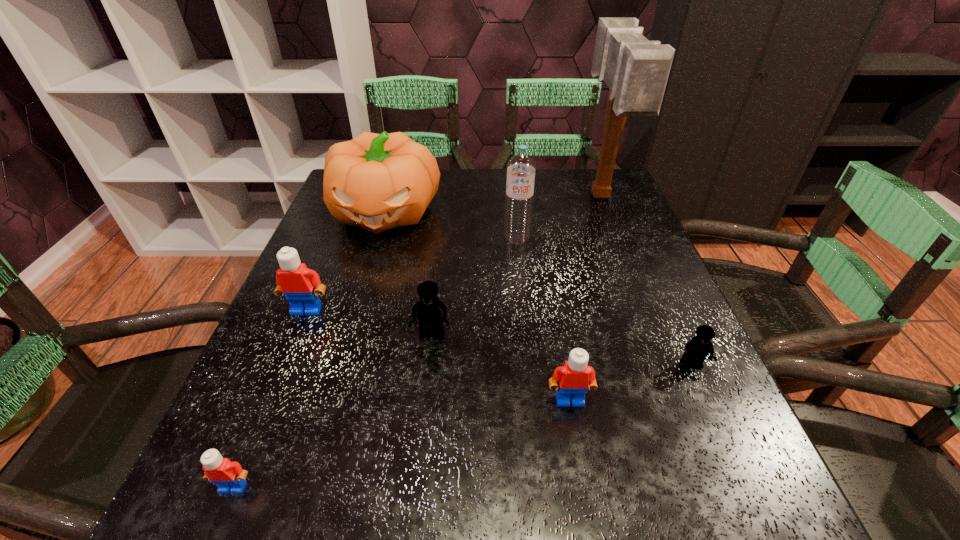
This screenshot has width=960, height=540. I want to click on vacant space at the far edge of the desktop, so click(502, 181).

Identify the location of free space at the near edge of the desktop. (341, 519).

Locate an element on the screen. This screenshot has width=960, height=540. free space at the left edge is located at coordinates (310, 431).

Image resolution: width=960 pixels, height=540 pixels. I want to click on free space at the right edge of the desktop, so click(x=645, y=322).

Identify the location of vacant position at the near left corner of the desktop. The image size is (960, 540). (207, 536).

Find the location of a particular element. Image resolution: width=960 pixels, height=540 pixels. free point between the pumpkin and the smallest white Lego is located at coordinates coord(309,350).

At what (x,y) coordinates should I click in order to perform the action: click on free spot between the fourth nearest object and the second biggest white Lego. Please return your answer as a coordinate pair (x, y). Looking at the image, I should click on (500, 367).

Locate an element on the screen. vacant space that is in between the smallest white Lego and the smaller yellow Lego is located at coordinates (462, 426).

Find the location of `free point between the water bottle and the second nearest Lego`. free point between the water bottle and the second nearest Lego is located at coordinates (543, 319).

The width and height of the screenshot is (960, 540). In order to click on vacant point located between the left yellow Lego and the wood mallet in this screenshot , I will do `click(516, 266)`.